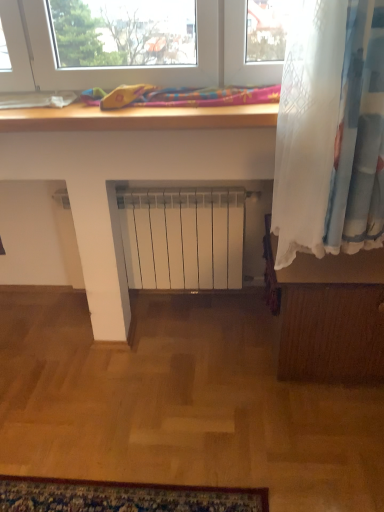
Question: Is multicolored fabric at upper center outside of wooden floorboard at right?

Choices:
 (A) no
 (B) yes

Answer: (B)

Question: Would you consider multicolored fabric at upper center to be distant from wooden floorboard at right?

Choices:
 (A) no
 (B) yes

Answer: (A)

Question: From a real-world perspective, is multicolored fabric at upper center positioned over wooden floorboard at right based on gravity?

Choices:
 (A) no
 (B) yes

Answer: (B)

Question: Is multicolored fabric at upper center shorter than wooden floorboard at right?

Choices:
 (A) yes
 (B) no

Answer: (A)

Question: Does multicolored fabric at upper center have a greater height compared to wooden floorboard at right?

Choices:
 (A) no
 (B) yes

Answer: (A)

Question: Is multicolored fabric at upper center smaller than wooden floorboard at right?

Choices:
 (A) yes
 (B) no

Answer: (A)

Question: Is wooden floorboard at right thinner than multicolored fabric at upper center?

Choices:
 (A) yes
 (B) no

Answer: (B)

Question: From the image's perspective, does wooden floorboard at right appear higher than multicolored fabric at upper center?

Choices:
 (A) yes
 (B) no

Answer: (B)

Question: Is wooden floorboard at right bigger than multicolored fabric at upper center?

Choices:
 (A) yes
 (B) no

Answer: (A)

Question: Is wooden floorboard at right in front of multicolored fabric at upper center?

Choices:
 (A) yes
 (B) no

Answer: (B)

Question: From the image's perspective, is wooden floorboard at right beneath multicolored fabric at upper center?

Choices:
 (A) no
 (B) yes

Answer: (B)

Question: Considering the relative positions of wooden floorboard at right and multicolored fabric at upper center in the image provided, is wooden floorboard at right to the right of multicolored fabric at upper center from the viewer's perspective?

Choices:
 (A) yes
 (B) no

Answer: (A)

Question: Based on their positions, is wooden floorboard at right located to the left or right of multicolored fabric at upper center?

Choices:
 (A) right
 (B) left

Answer: (A)